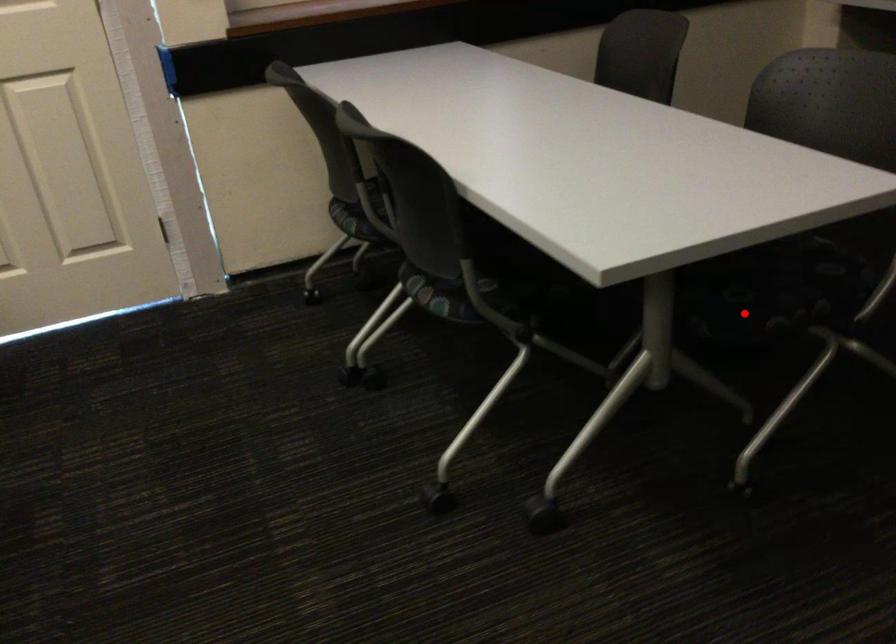
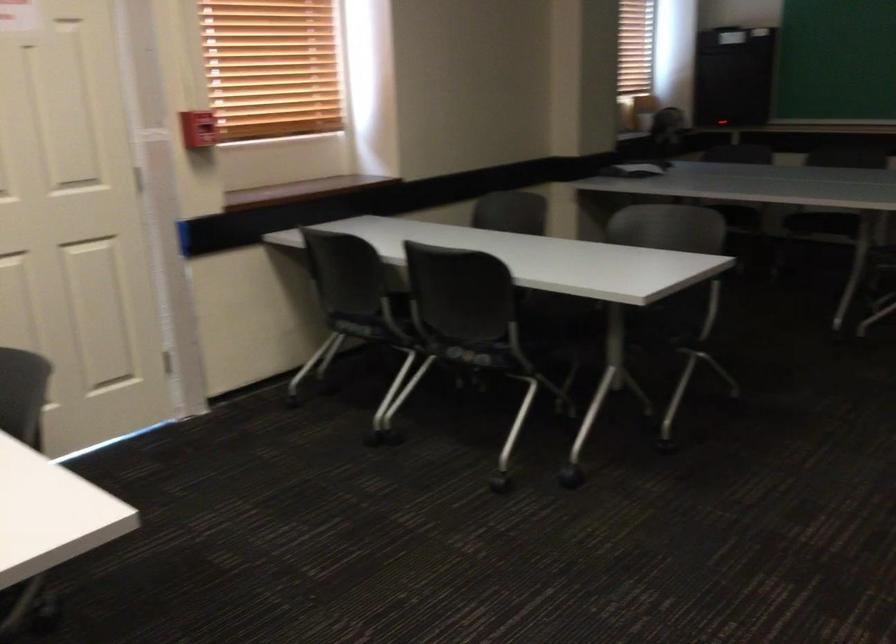
In the second image, find the point that corresponds to the highlighted location in the first image.

(657, 337)